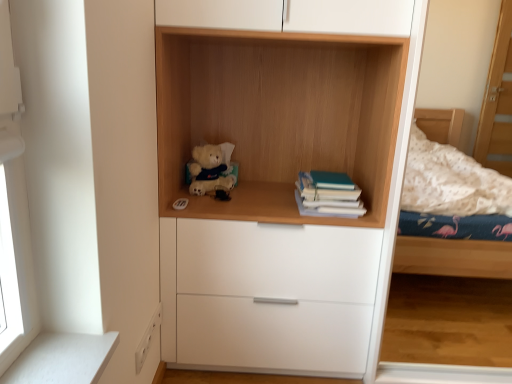
Image resolution: width=512 pixels, height=384 pixels. What are the coordinates of `unoccupied region to the right of soft plush teddy bear at center` in the screenshot? It's located at (246, 194).